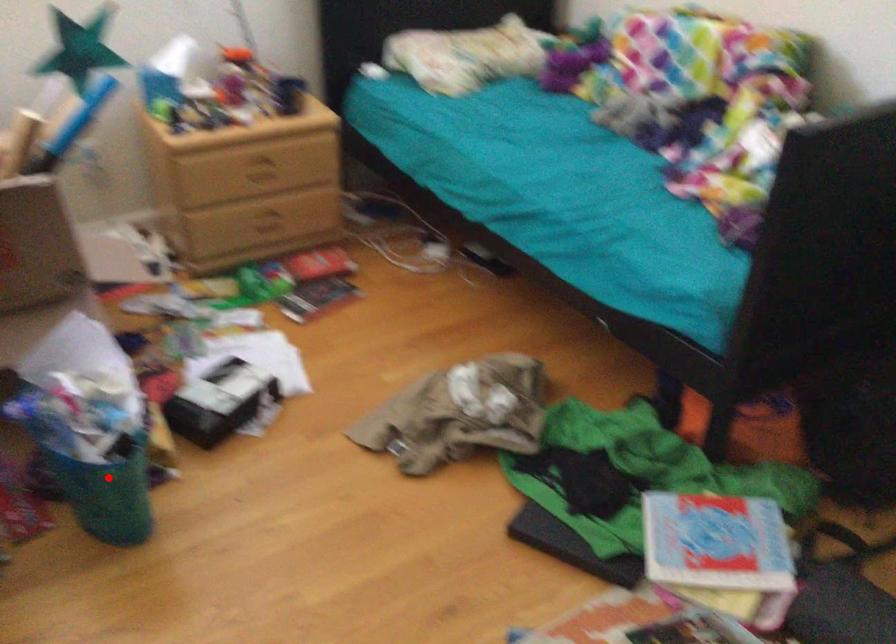
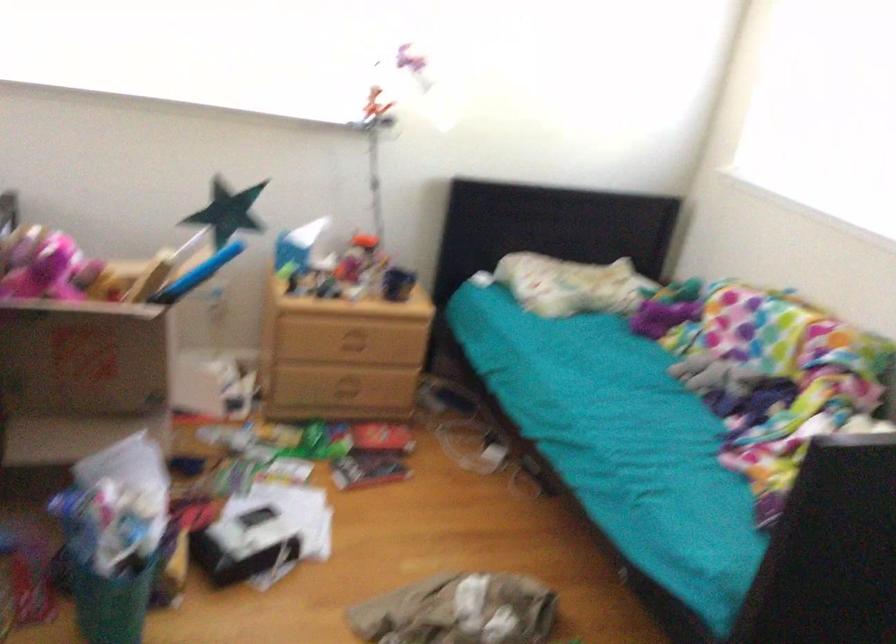
In the second image, find the point that corresponds to the highlighted location in the first image.

(108, 592)